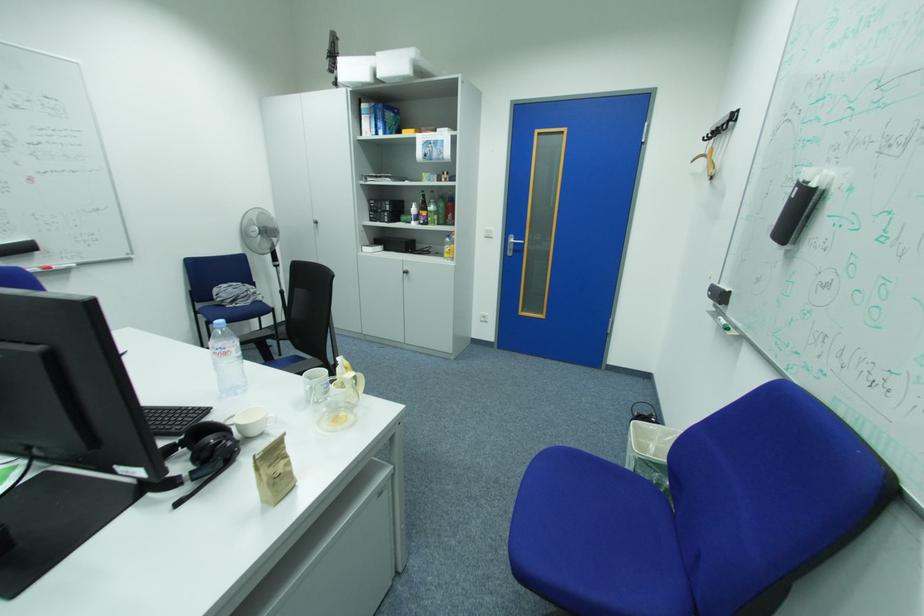
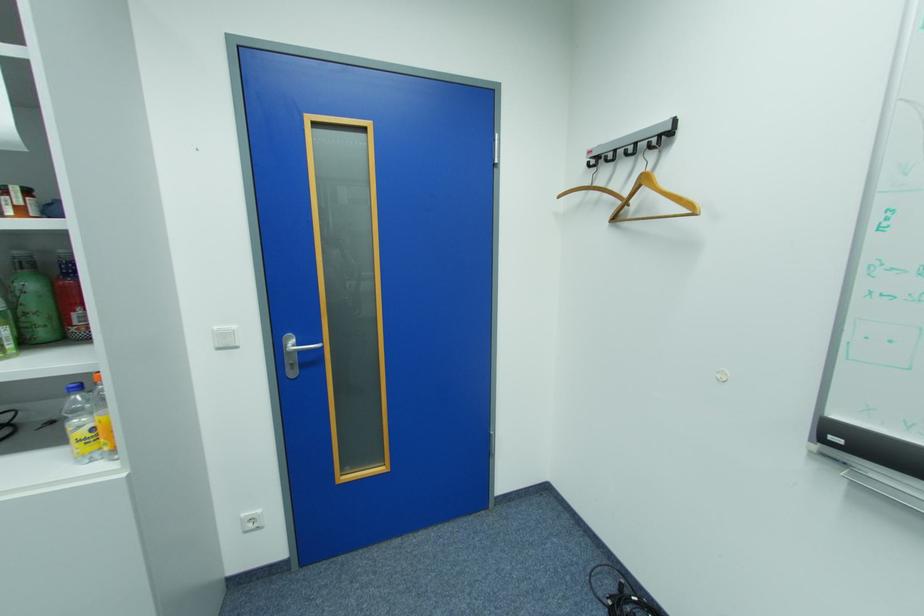
Where in the second image is the point corresponding to pixel 523 241 from the first image?

(307, 344)